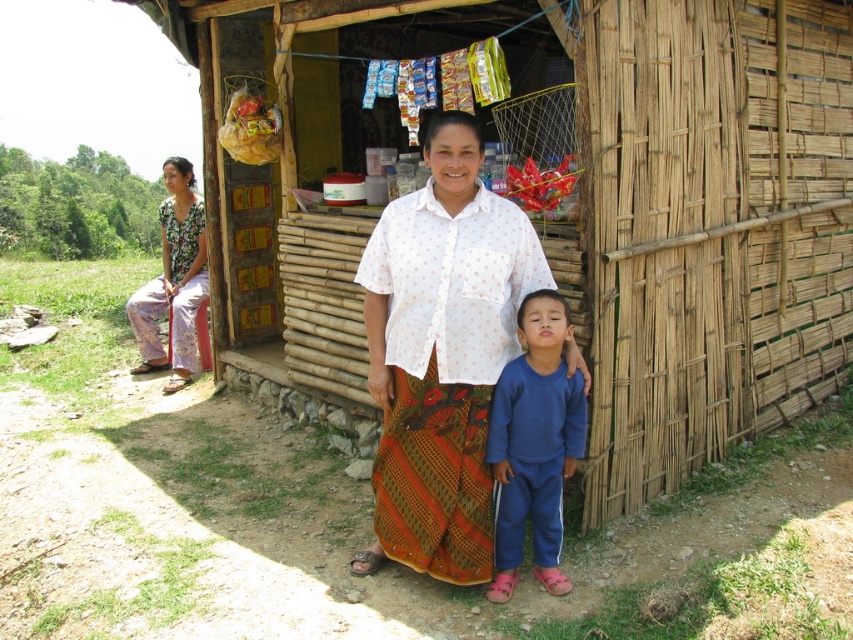
The image size is (853, 640). What are the coordinates of `bamboo hut at center` in the screenshot? It's located at (590, 211).

Between point (714, 108) and point (370, 566), which one is positioned behind?

The point (714, 108) is more distant.

Who is more forward, (717, 26) or (381, 561)?

Positioned in front is point (381, 561).

What are the coordinates of `bamboo hut at center` in the screenshot? It's located at (590, 211).

Can you confirm if blue fleece pants at lower right is wider than floral fabric pants at left?

In fact, blue fleece pants at lower right might be narrower than floral fabric pants at left.

Can you confirm if blue fleece pants at lower right is smaller than floral fabric pants at left?

Indeed, blue fleece pants at lower right has a smaller size compared to floral fabric pants at left.

The height and width of the screenshot is (640, 853). Find the location of `blue fleece pants at lower right`. blue fleece pants at lower right is located at coordinates (532, 444).

Is bamboo hut at center closer to the viewer compared to blue fleece pants at lower right?

No.

Does bamboo hut at center have a smaller size compared to blue fleece pants at lower right?

Actually, bamboo hut at center might be larger than blue fleece pants at lower right.

Which is behind, point (585, 147) or point (561, 339)?

Point (585, 147)

Where is `bamboo hut at center`? bamboo hut at center is located at coordinates (590, 211).